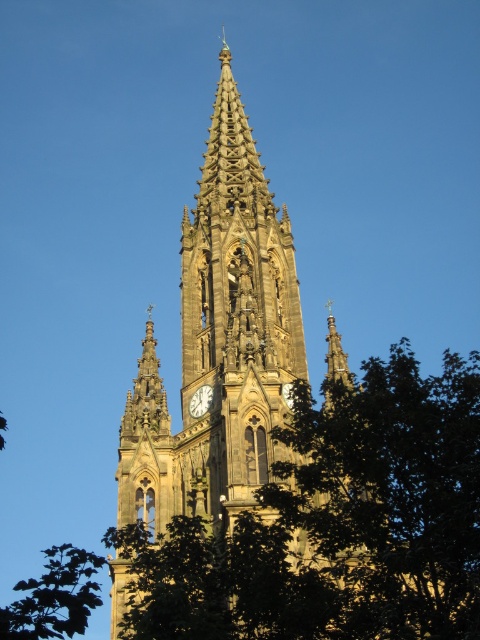
You are standing in front of the Gothic church and want to take a photo that includes both the brown stone tower at center and the green leafy tree at lower left. Which object should you position closer to the bottom of your camera frame to ensure both are fully visible?

You should position the green leafy tree at lower left closer to the bottom of your camera frame because the brown stone tower at center is taller than the green leafy tree at lower left, so placing the tree lower will ensure both fit within the frame.

Based on the scene description, where is the brown stone tower at center located in terms of its 2D coordinates?

The brown stone tower at center is located at the 2D coordinates of point (x=218, y=346).